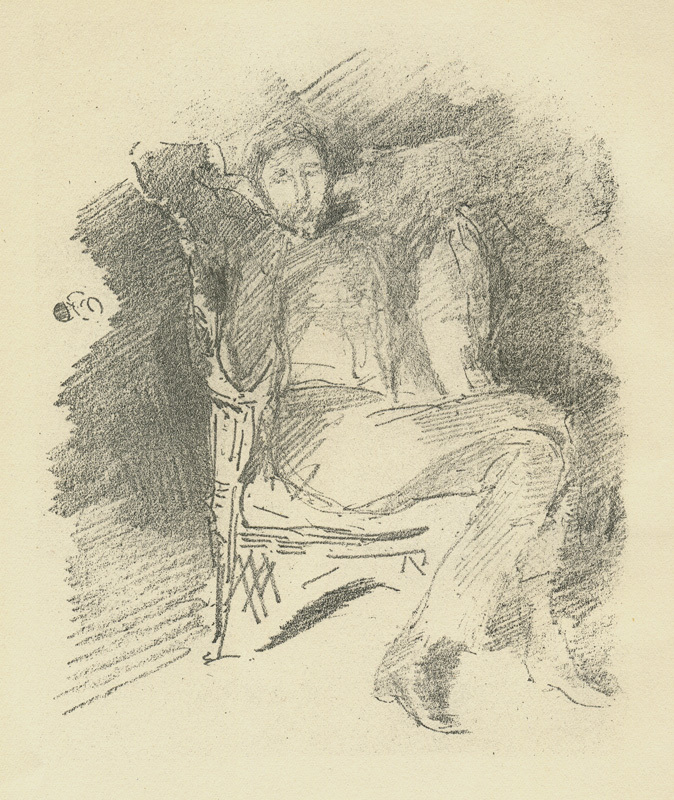
Identify the location of chair. Image resolution: width=674 pixels, height=800 pixels. (265, 568).